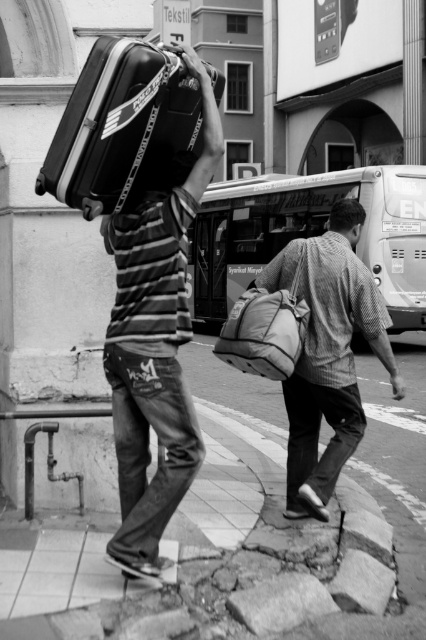
Is point (409, 186) farther from camera compared to point (333, 301)?

Yes, it is.

In the scene shown: Is the position of metallic silver bus at center less distant than that of checkered fabric shirt at center?

Yes, metallic silver bus at center is closer to the viewer.

Find the location of a particular element. This screenshot has width=426, height=640. metallic silver bus at center is located at coordinates pyautogui.click(x=310, y=234).

In the scene shown: Measure the distance between smooth concrete pavement at lower center and matte black suitcase at upper left.

The distance of smooth concrete pavement at lower center from matte black suitcase at upper left is 4.99 feet.

Between point (199, 388) and point (150, 214), which one is positioned behind?

Positioned behind is point (199, 388).

Is point (135, 636) positioned in front of point (175, 269)?

Yes, point (135, 636) is in front of point (175, 269).

The height and width of the screenshot is (640, 426). Identify the location of smooth concrete pavement at lower center. (215, 524).

Between smooth concrete pavement at lower center and metallic silver bus at center, which one has less height?

Standing shorter between the two is smooth concrete pavement at lower center.

Does smooth concrete pavement at lower center appear under metallic silver bus at center?

Yes, smooth concrete pavement at lower center is below metallic silver bus at center.

Who is more distant from viewer, (43, 595) or (322, 189)?

The point (322, 189) is behind.

Where is `smooth concrete pavement at lower center`? This screenshot has width=426, height=640. smooth concrete pavement at lower center is located at coordinates (215, 524).